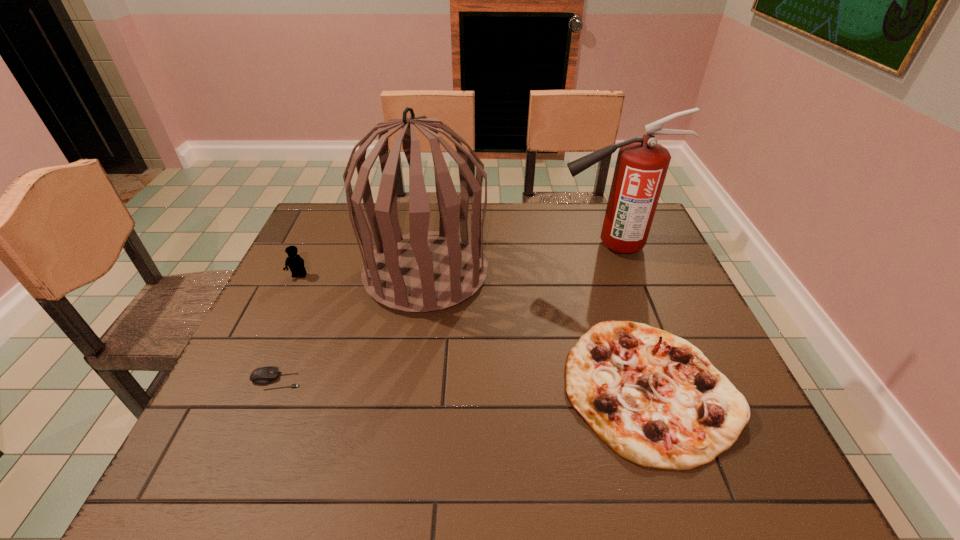
Where is `object situated at the near right corner`? Image resolution: width=960 pixels, height=540 pixels. object situated at the near right corner is located at coordinates tap(653, 398).

Where is `vacant region at the far edge`? vacant region at the far edge is located at coordinates (522, 210).

You are a GUI agent. You are given a task and a screenshot of the screen. Output one action in this format:
    pyautogui.click(x=<x>, y=<y>)
    Task: Click on the vacant space at the left edge of the desktop
    The image size is (960, 540).
    Given the screenshot: What is the action you would take?
    pyautogui.click(x=277, y=292)

Identify the location of vacant space at the right edge. (616, 259).

Where is `free space between the second shortest object and the shortest object`? This screenshot has width=960, height=540. free space between the second shortest object and the shortest object is located at coordinates (462, 384).

Locate an element on the screen. This screenshot has width=960, height=540. free space between the third object from left to right and the second shortest object is located at coordinates (537, 330).

Find the location of a particular element. The width and height of the screenshot is (960, 540). free spot between the fire extinguisher and the second shortest object is located at coordinates (629, 316).

The height and width of the screenshot is (540, 960). I want to click on free space between the pizza and the fire extinguisher, so (629, 316).

Identify the location of free space between the third object from right to left and the second shortest object. This screenshot has height=540, width=960. (537, 330).

Identify the location of free space between the fourth tallest object and the shortest object. The height and width of the screenshot is (540, 960). (462, 384).